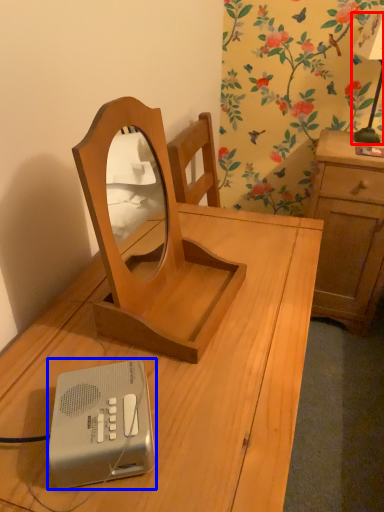
Question: Which object is further to the camera taking this photo, bedside lamp (highlighted by a red box) or ipod (highlighted by a blue box)?

Choices:
 (A) bedside lamp
 (B) ipod

Answer: (A)